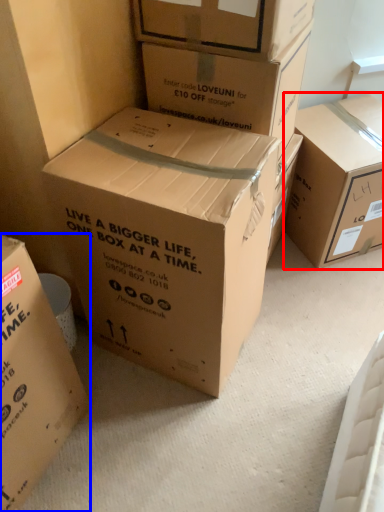
Question: Which of the following is the farthest to the observer, box (highlighted by a red box) or box (highlighted by a blue box)?

Choices:
 (A) box
 (B) box

Answer: (A)